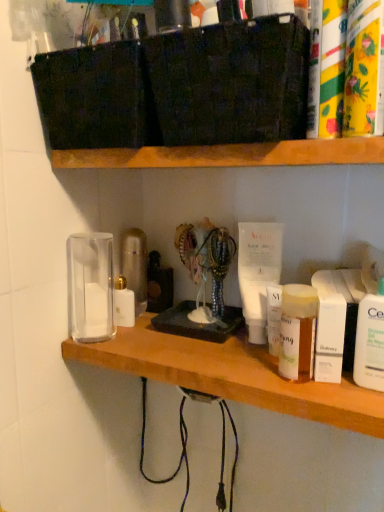
Question: Is point (342, 3) closer or farther from the camera than point (382, 153)?

Choices:
 (A) farther
 (B) closer

Answer: (B)

Question: From a real-world perspective, is yellow paper towel roll at upper right, which is counted as the 5th toiletry, starting from the back, above or below wooden shelf at upper center, positioned as the first shelf in top-to-bottom order?

Choices:
 (A) below
 (B) above

Answer: (B)

Question: Which of these objects is positioned closest to the white glossy lotion at left, which ranks as the 1th toiletry in back-to-front order?

Choices:
 (A) floral-patterned plastic bottle at upper right, which is the second toiletry in right-to-left order
 (B) white plastic lotion at right, which ranks as the first toiletry in right-to-left order
 (C) clear glass jar at center, acting as the 2th shelf starting from the top
 (D) wooden shelf at upper center, the second shelf ordered from the bottom
 (E) white matte box at right, which appears as the fourth toiletry when viewed from the left

Answer: (C)

Question: Considering the real-world distances, which object is farthest from the floral-patterned plastic bottle at upper right, the fifth toiletry viewed from the left?

Choices:
 (A) white plastic lotion at right, the third toiletry viewed from the front
 (B) yellow paper towel roll at upper right, which appears as the fourth toiletry when viewed from the right
 (C) translucent plastic jar at center right, which ranks as the 5th toiletry in right-to-left order
 (D) white glossy lotion at left, placed as the 6th toiletry when sorted from front to back
 (E) white matte box at right, acting as the third toiletry starting from the back

Answer: (D)